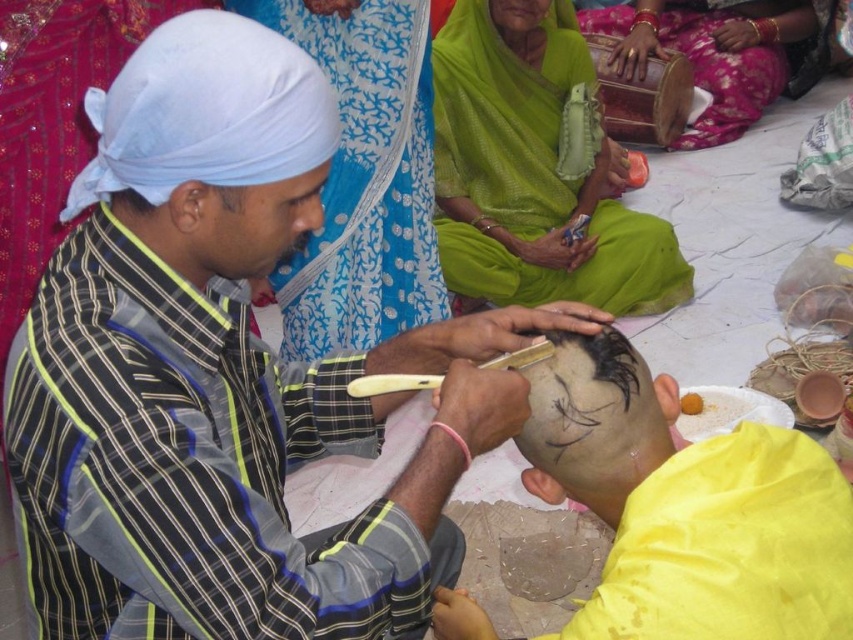
You are an artist visiting this cultural scene and want to place a new decoration between the matte clay mask at center and the wooden drum at upper right. Based on their positions, where should you place it to keep it centered between them?

The matte clay mask at center is to the left of the wooden drum at upper right, so placing the new decoration halfway between them would position it between the matte clay mask at center and the wooden drum at upper right.

You are an artist visiting this cultural scene. You want to take a photo of the matte clay mask at center and the wooden drum at upper right. Which object should you focus on first to ensure both are in the frame?

The matte clay mask at center is in front of the wooden drum at upper right, so you should focus on the matte clay mask at center first to ensure both are in the frame.

You are an anthropologist observing this traditional Indian art session. You notice the smooth white turban at upper left and the smooth green fabric at center. Which object is positioned to the left of the other?

The smooth white turban at upper left is to the left of the smooth green fabric at center.